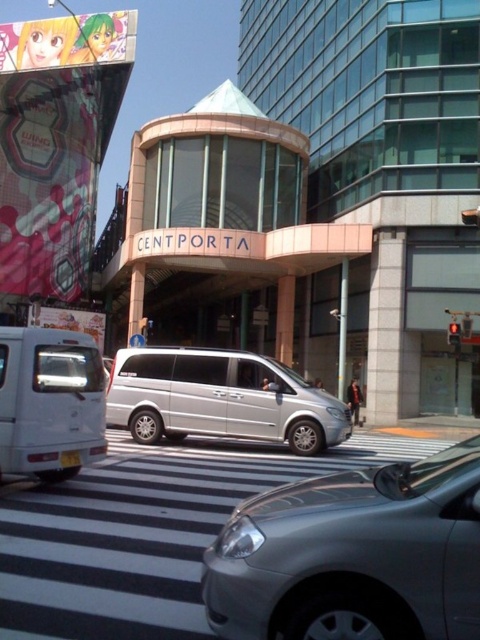
Question: From the image, what is the correct spatial relationship of silver metallic car at center in relation to silver metallic van at center?

Choices:
 (A) above
 (B) below

Answer: (A)

Question: Is the position of silver metallic car at center more distant than that of white matte van at left?

Choices:
 (A) yes
 (B) no

Answer: (B)

Question: Can you confirm if silver metallic car at center is wider than silver metallic van at center?

Choices:
 (A) no
 (B) yes

Answer: (A)

Question: Which of these objects is positioned farthest from the silver metallic van at center?

Choices:
 (A) white matte van at left
 (B) silver metallic car at center

Answer: (B)

Question: Considering the real-world distances, which object is farthest from the silver metallic van at center?

Choices:
 (A) white matte van at left
 (B) silver metallic car at center

Answer: (B)

Question: Which is nearer to the silver metallic car at center?

Choices:
 (A) white matte van at left
 (B) silver metallic van at center

Answer: (A)